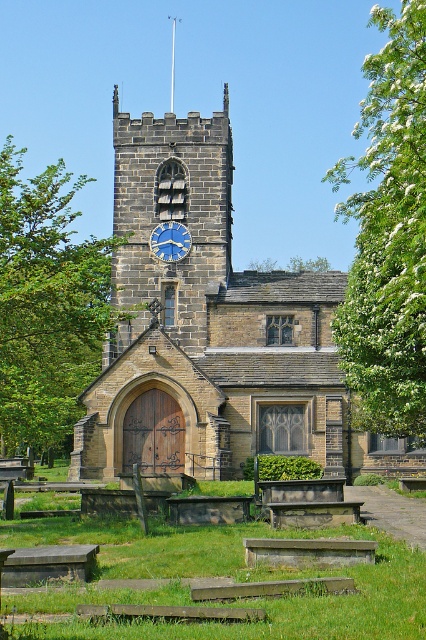
You are standing in front of the historic stone church and want to take a photo of the blue painted stone clock at upper center. The camera you are using has a maximum focus range of 350 feet. Will the camera be able to focus on the clock?

The blue painted stone clock at upper center is 366.17 feet away from camera, which exceeds the camera maximum focus range of 350 feet. Therefore, the camera will not be able to focus on the clock.

You are standing in front of the brown stone church at center. What are the coordinates of its 2D location?

The 2D location of the brown stone church at center is at point (204, 326).